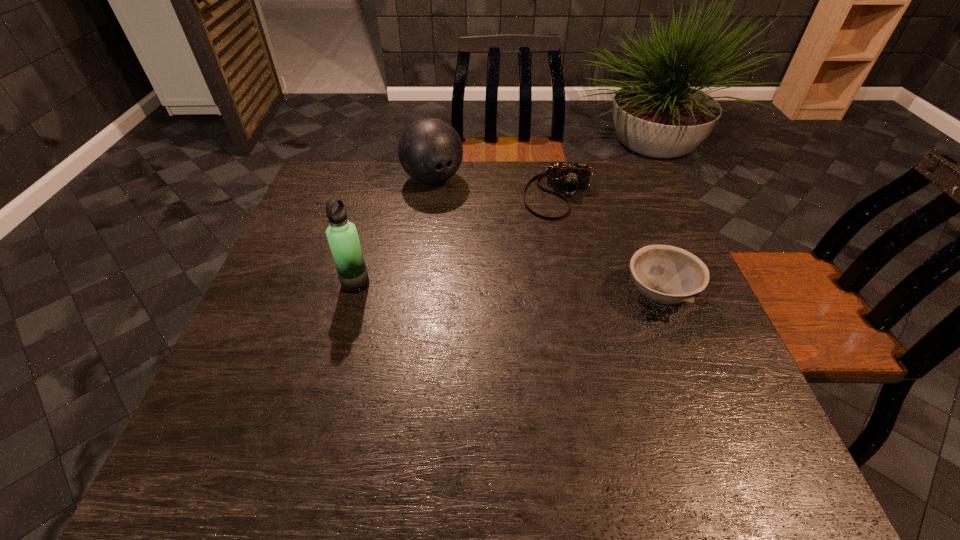
Locate an element on the screen. The height and width of the screenshot is (540, 960). free space on the desktop that is between the leftmost object and the second shortest object and is positioned on the grip area of the third shortest object is located at coordinates (532, 290).

Locate an element on the screen. This screenshot has height=540, width=960. free spot on the desktop that is between the tallest object and the bowl and is positioned on the front-facing side of the camera is located at coordinates (548, 291).